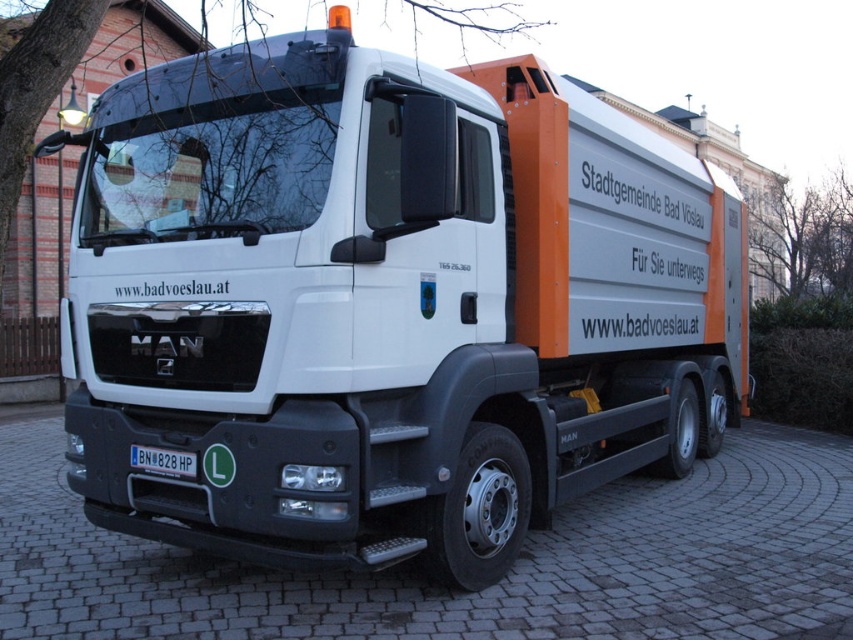
You are standing 10 meters away from a refuse collection truck. You want to reach the bare branches at upper right. Can you estimate if you can walk directly to them without moving past the truck?

The distance between the bare branches at upper right and the viewer is 9.67 meters, so you are already within the 10 meters range. You can walk directly to the bare branches at upper right without needing to move past the truck.

You are a driver looking at the refuse collection truck. You notice two objects in the image. One is bare branches at upper left and the other is black plastic license plate at lower center. Which of these two objects appears bigger in the image?

The bare branches at upper left appears bigger in the image compared to the black plastic license plate at lower center as per the description.